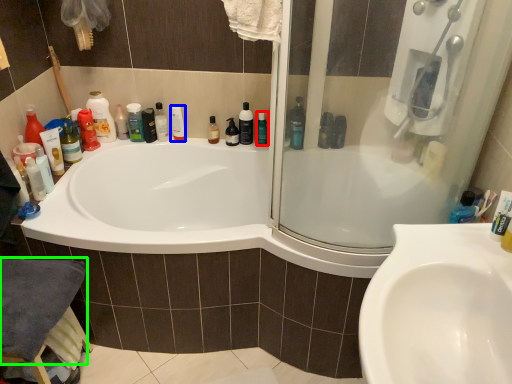
Question: Which object is positioned closest to mouthwash (highlighted by a red box)? Select from mouthwash (highlighted by a blue box) and bath towel (highlighted by a green box).

Choices:
 (A) mouthwash
 (B) bath towel

Answer: (A)